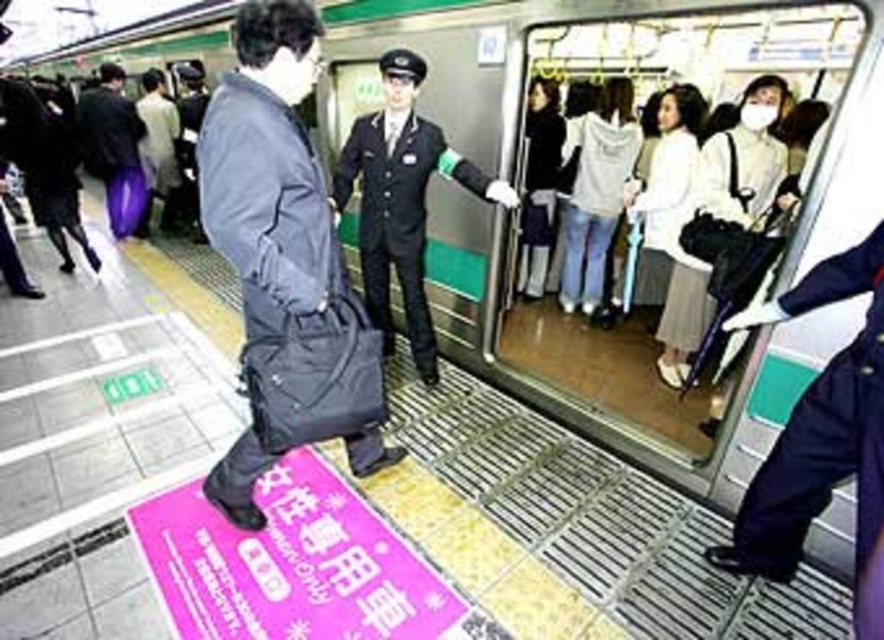
You are standing at the point marked as point (284,433) in the subway station. The train is approaching the platform. To ensure safety, you need to stay at least 1 meter away from the edge. Can you safely stand at your current position?

The distance between you and the camera is 2.11 meters, so yes, you can safely stand at point (284,433) because it is more than 1 meter away from the edge.

You are a passenger at the subway station and notice a black uniform at center and a purple fabric bag at left. Which object is closer to the platform edge?

The black uniform at center is closer to the platform edge because it is shorter than the purple fabric bag at left, meaning it is positioned closer to the edge where the train approaches.

You are a passenger at the subway station and you have two bags with you, the matte black bag at center and the purple fabric bag at left. You need to place one of them on the shelf above the seat in the train. Which bag should you choose based on their positions?

The purple fabric bag at left should be chosen because it is already positioned above the matte black bag at center, making it easier to reach the shelf above the seat.